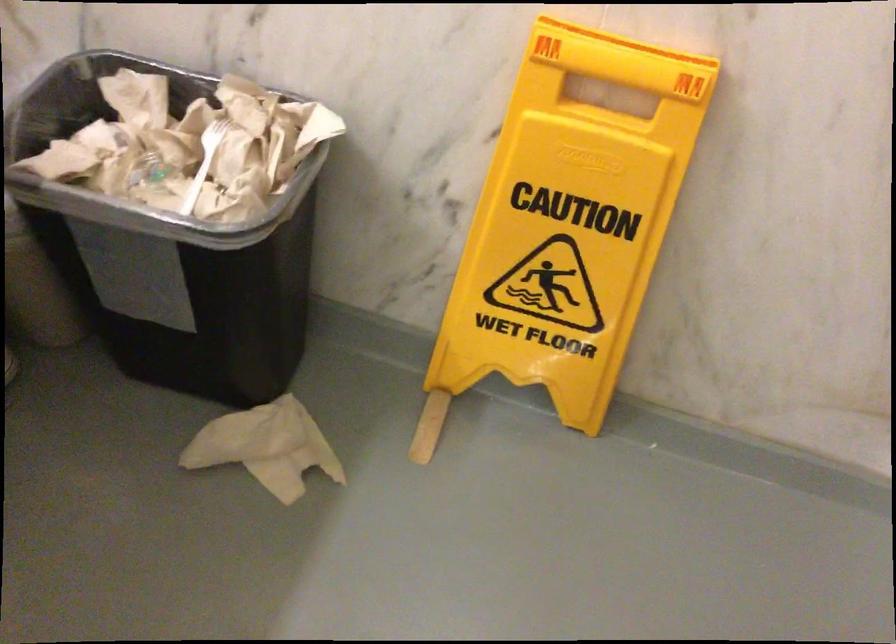
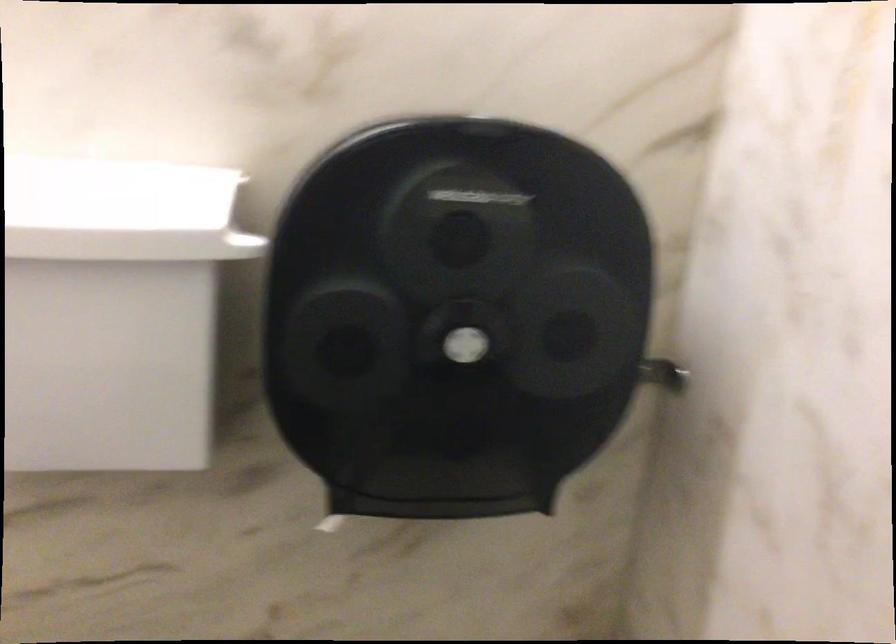
Question: The camera is either moving clockwise (left) or counter-clockwise (right) around the object. The first image is from the beginning of the video and the second image is from the end. Is the camera moving left or right when shooting the video?

Choices:
 (A) Left
 (B) Right

Answer: (B)